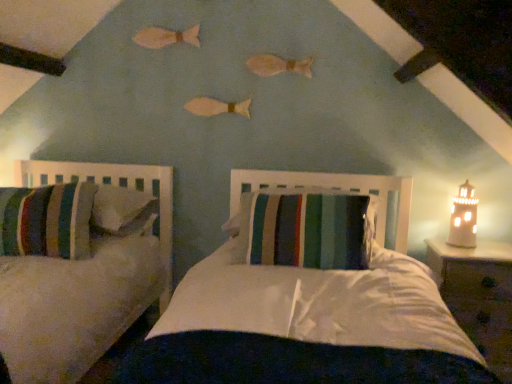
Question: Is white ceramic lighthouse at right situated inside wooden nightstand at right or outside?

Choices:
 (A) outside
 (B) inside

Answer: (A)

Question: In terms of height, does white ceramic lighthouse at right look taller or shorter compared to wooden nightstand at right?

Choices:
 (A) short
 (B) tall

Answer: (A)

Question: Which object is the farthest from the striped fabric pillow at center?

Choices:
 (A) wooden nightstand at right
 (B) white ceramic lighthouse at right

Answer: (B)

Question: Based on their relative distances, which object is farther from the striped fabric pillow at center?

Choices:
 (A) white ceramic lighthouse at right
 (B) wooden nightstand at right

Answer: (A)